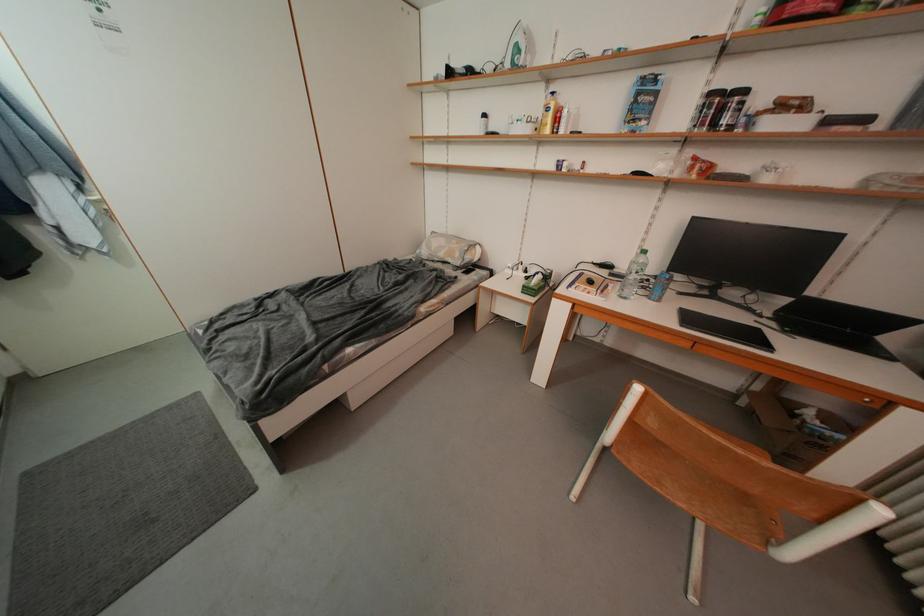
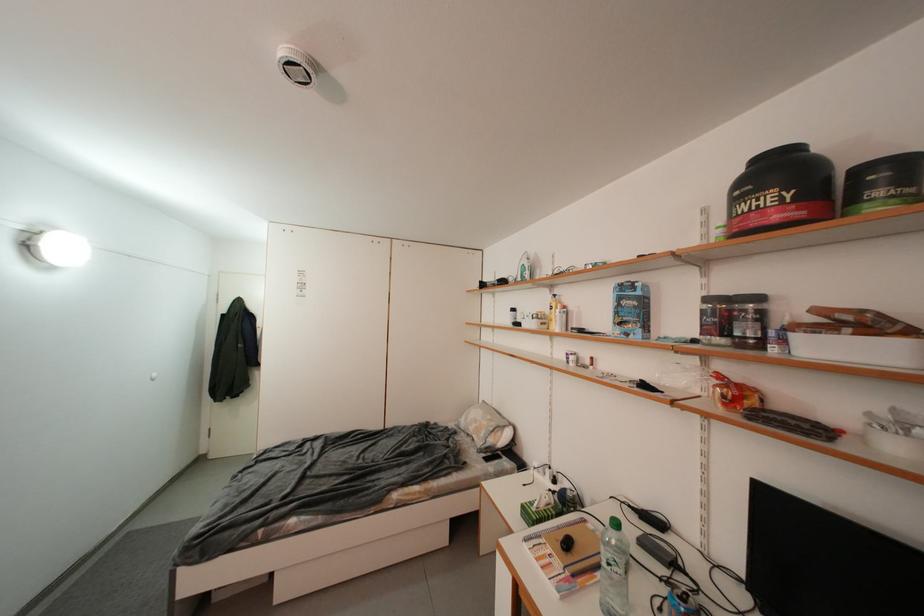
Where in the second image is the point corresponding to [617,292] from the first image?

(606, 578)